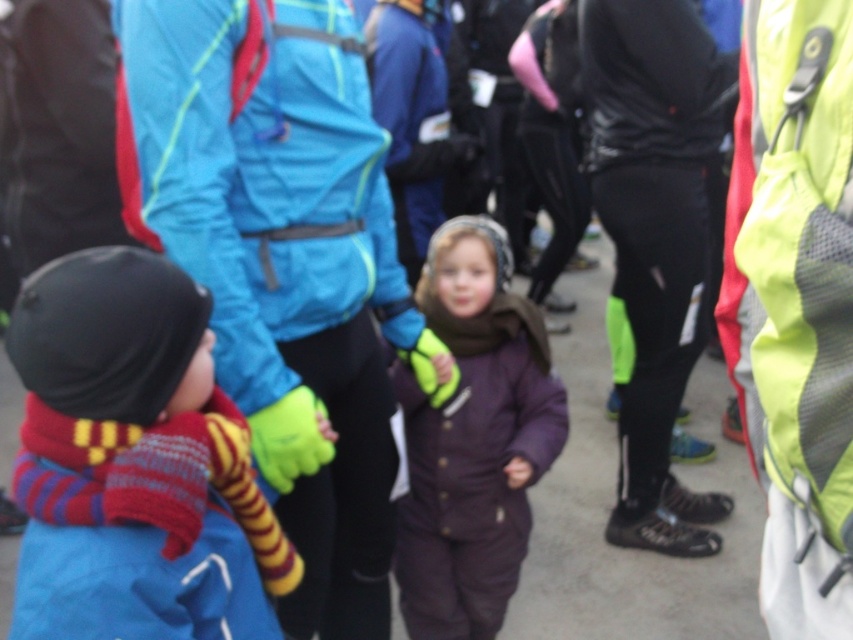
Based on the scene description, where is the knitted wool sweater at left located in terms of its 2D coordinates?

The knitted wool sweater at left is located at the 2D coordinates of point [125,460].

You are standing at the origin of the coordinate system in the image. You see two points, point (117, 369) and point (474, 426). Which point is closer to you?

Point (117, 369) is in front of point (474, 426), so it is closer to you.

Based on the scene description, which object is shorter in height between the knitted wool sweater at left and the purple fleece snowsuit at center?

The knitted wool sweater at left is shorter in height than the purple fleece snowsuit at center.